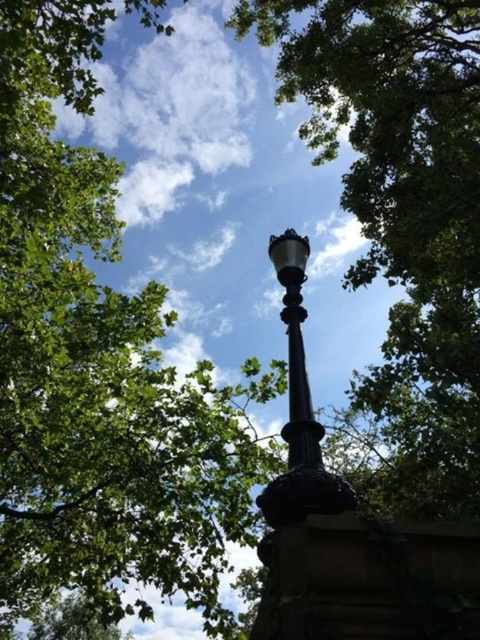
You are a city planner reviewing a design for a new park. The design includes the polished black lamppost at upper center and the black polished metal pole at center. Based on the provided image, which object is the larger one in the design?

The polished black lamppost at upper center is larger in size than the black polished metal pole at center.

You are standing in the outdoor scene and want to touch both the polished black lamppost at upper center and the black polished metal pole at center. Which one do you need to walk towards first?

You should walk towards the polished black lamppost at upper center first because it is closer to you than the black polished metal pole at center.